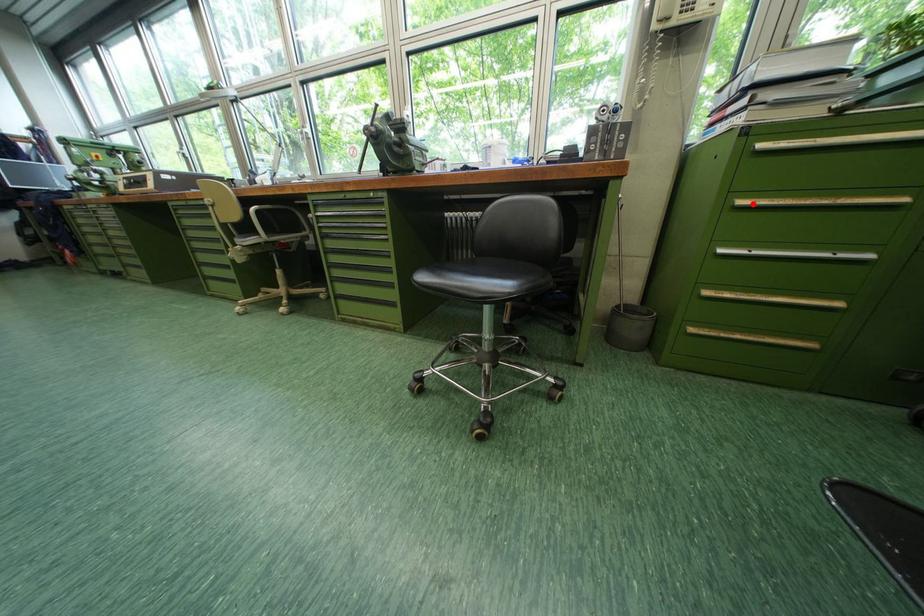
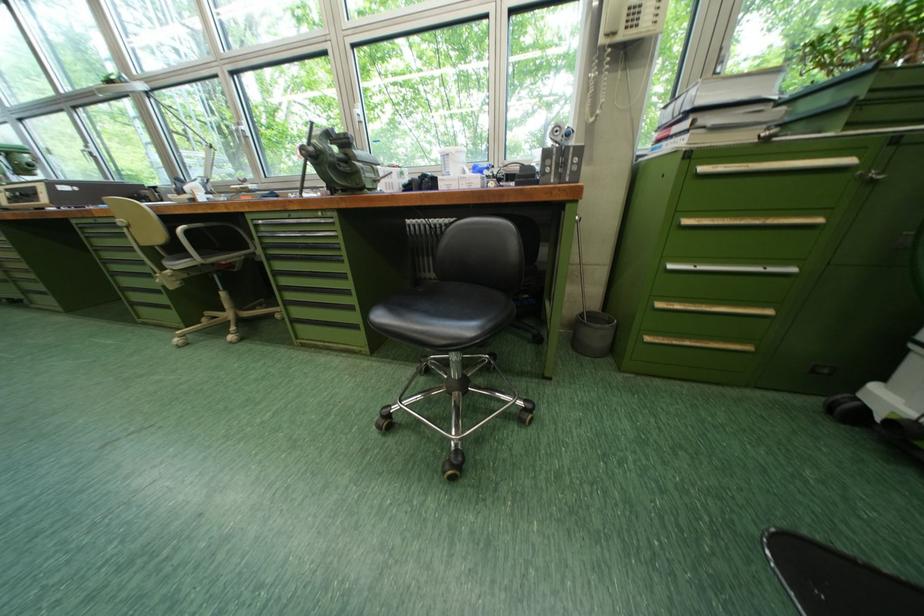
The point at the highlighted location is marked in the first image. Where is the corresponding point in the second image?

(698, 224)